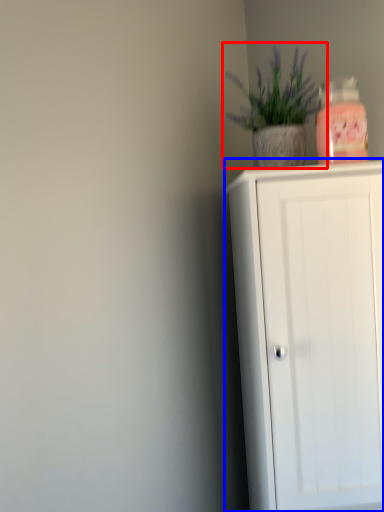
Question: Which point is further to the camera, houseplant (highlighted by a red box) or cupboard (highlighted by a blue box)?

Choices:
 (A) houseplant
 (B) cupboard

Answer: (A)